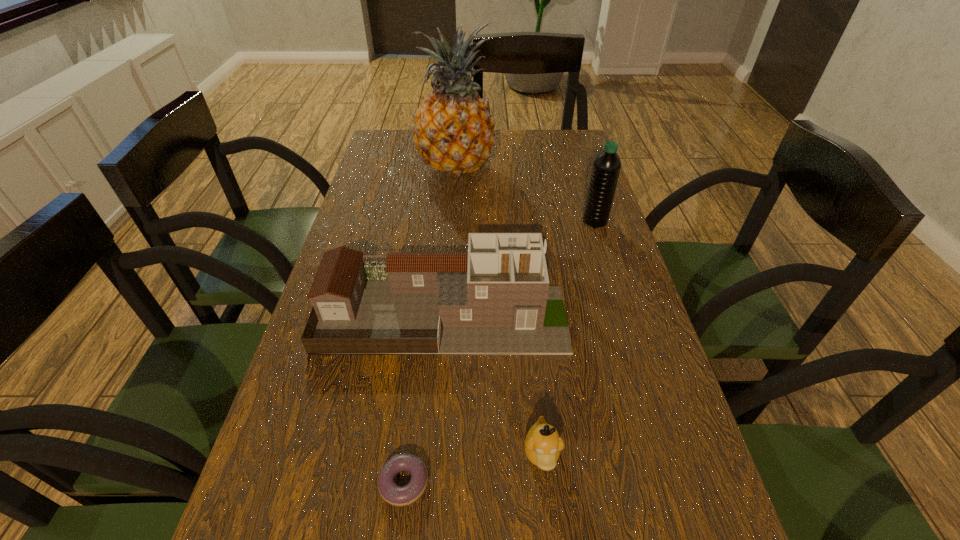
Find the location of `vacant space situated at the main entrance of the dollhouse`. vacant space situated at the main entrance of the dollhouse is located at coordinates (601, 313).

Locate an element on the screen. The height and width of the screenshot is (540, 960). free space located on the face of the fourth tallest object is located at coordinates (548, 515).

This screenshot has height=540, width=960. I want to click on vacant region located 0.390m on the back of the shortest object, so click(x=426, y=294).

This screenshot has width=960, height=540. What are the coordinates of `object that is at the far edge` in the screenshot? It's located at (453, 130).

You are a GUI agent. You are given a task and a screenshot of the screen. Output one action in this format:
    pyautogui.click(x=<x>, y=<y>)
    Task: Click on the pineapple at the left edge
    
    Given the screenshot: What is the action you would take?
    pyautogui.click(x=453, y=130)

Locate an element on the screen. This screenshot has width=960, height=540. dollhouse present at the left edge is located at coordinates (495, 299).

The width and height of the screenshot is (960, 540). Find the location of `object that is at the right edge`. object that is at the right edge is located at coordinates (606, 168).

Locate an element on the screen. The image size is (960, 540). object located in the far left corner section of the desktop is located at coordinates (453, 130).

Locate an element on the screen. This screenshot has height=540, width=960. free space at the far edge of the desktop is located at coordinates (535, 145).

I want to click on free location at the left edge of the desktop, so click(364, 366).